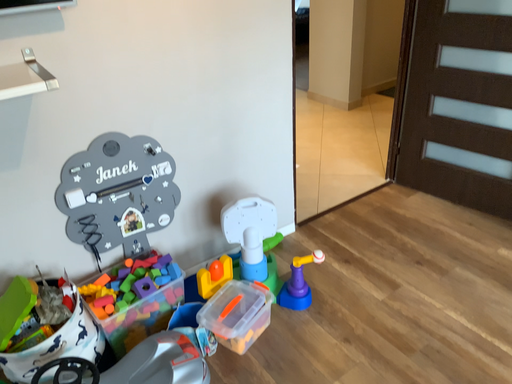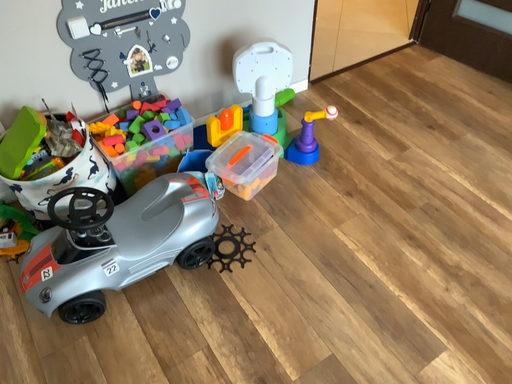
Question: Which way did the camera rotate in the video?

Choices:
 (A) rotated upward
 (B) rotated downward

Answer: (B)